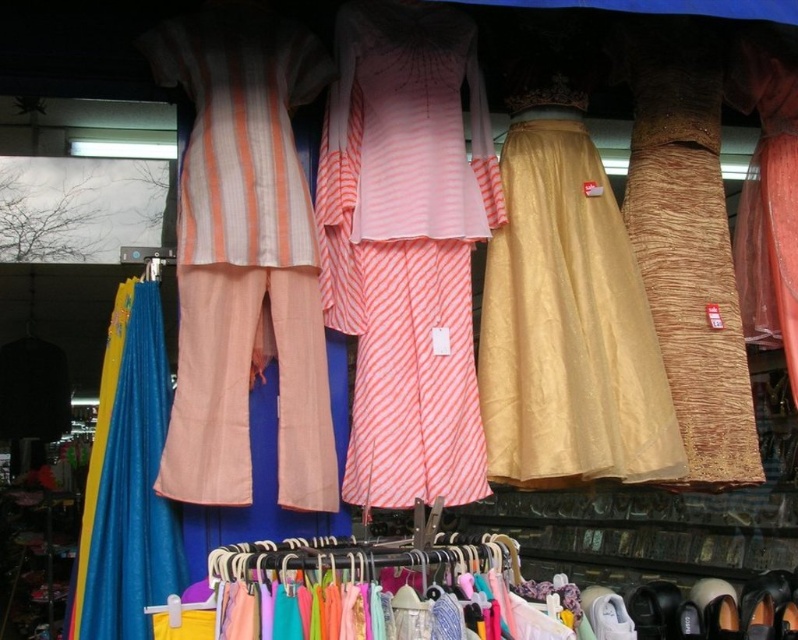
Who is more forward, (453, 154) or (210, 68)?

Point (210, 68)

Is pink striped fabric dress at center positioned in front of striped peach pants at left?

No, pink striped fabric dress at center is further to the viewer.

Does point (403, 161) come farther from viewer compared to point (164, 83)?

Yes, point (403, 161) is behind point (164, 83).

Locate an element on the screen. The width and height of the screenshot is (798, 640). pink striped fabric dress at center is located at coordinates (405, 248).

Is point (617, 422) positioned in front of point (81, 524)?

Yes, it is in front of point (81, 524).

Does point (583, 374) lie behind point (121, 458)?

That is True.

The image size is (798, 640). What do you see at coordinates (567, 326) in the screenshot?
I see `gold satin dress at center` at bounding box center [567, 326].

Locate an element on the screen. Image resolution: width=798 pixels, height=640 pixels. gold satin dress at center is located at coordinates (567, 326).

Who is positioned more to the right, striped peach pants at left or gold satin dress at center?

Positioned to the right is gold satin dress at center.

Who is lower down, striped peach pants at left or gold satin dress at center?

Positioned lower is gold satin dress at center.

Is point (265, 259) positioned before point (611, 280)?

Yes, point (265, 259) is closer to viewer.

Identify the location of striped peach pants at left. (243, 259).